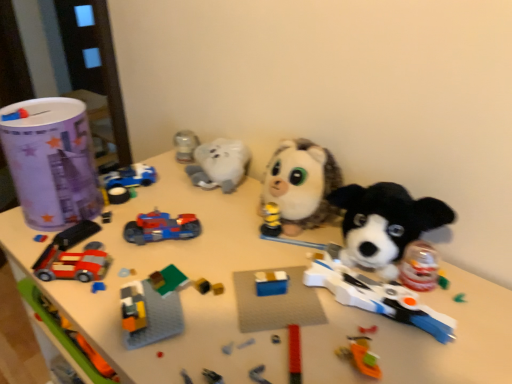
Find the location of a particular element. The image size is (512, 384). free spot to the right of shiny plastic toy car at center, which is counted as the second toy, starting from the right is located at coordinates (243, 242).